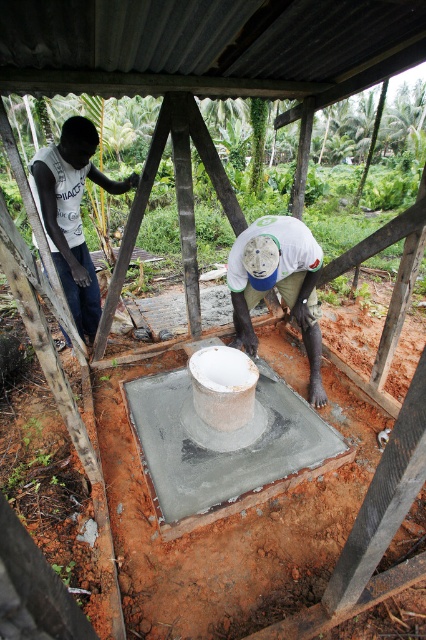
Question: Is matte white shirt at left above white matte concrete at center?

Choices:
 (A) yes
 (B) no

Answer: (A)

Question: Is matte white shirt at left below white matte concrete at center?

Choices:
 (A) no
 (B) yes

Answer: (A)

Question: Which point is farther to the camera?

Choices:
 (A) (71, 166)
 (B) (305, 288)

Answer: (A)

Question: Is matte white shirt at left to the right of white matte concrete at center from the viewer's perspective?

Choices:
 (A) yes
 (B) no

Answer: (B)